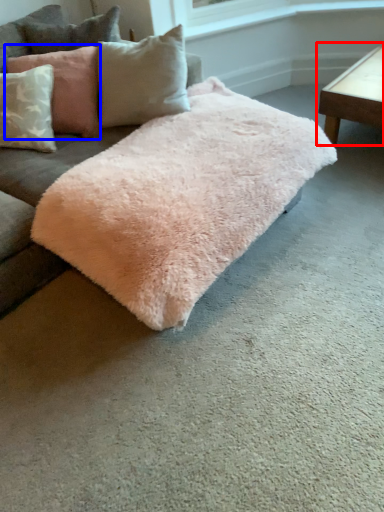
Question: Which object is further to the camera taking this photo, table (highlighted by a red box) or pillow (highlighted by a blue box)?

Choices:
 (A) table
 (B) pillow

Answer: (A)